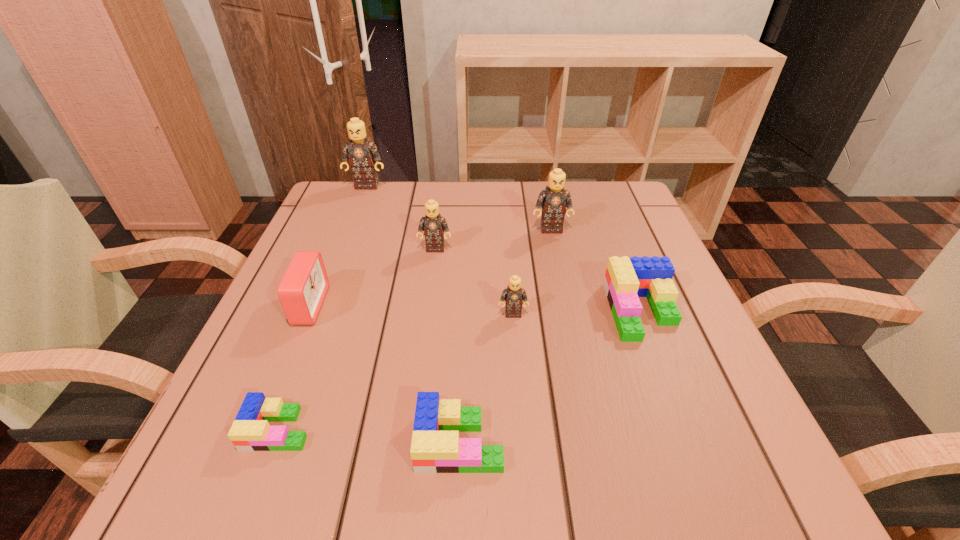
At what (x,y) coordinates should I click in order to perform the action: click on vacant region located on the left of the third shortest object. Please return your answer as a coordinate pair (x, y). Looking at the image, I should click on (488, 311).

What are the coordinates of `vacant area situated 0.110m on the left of the second shortest object` in the screenshot? It's located at (340, 442).

You are a GUI agent. You are given a task and a screenshot of the screen. Output one action in this format:
    pyautogui.click(x=<x>, y=<y>)
    Task: Click on the free space located 0.090m on the back of the smallest green Lego
    The height and width of the screenshot is (540, 960).
    Given the screenshot: What is the action you would take?
    pyautogui.click(x=304, y=361)

Image resolution: width=960 pixels, height=540 pixels. I want to click on alarm clock present at the left edge, so point(302,290).

At what (x,y) coordinates should I click in order to perform the action: click on object positioned at the right edge. Please return your answer as a coordinate pair (x, y). Looking at the image, I should click on (626, 279).

This screenshot has height=540, width=960. I want to click on object that is at the far left corner, so click(x=362, y=154).

This screenshot has width=960, height=540. What are the coordinates of `object present at the near left corner` in the screenshot? It's located at (250, 431).

In the image, there is a desktop. Where is `vacant space at the far edge`? The image size is (960, 540). vacant space at the far edge is located at coordinates (534, 186).

Identify the location of vacant region at the near edge of the desktop. (600, 446).

Where is `vacant space at the left edge`? The height and width of the screenshot is (540, 960). vacant space at the left edge is located at coordinates [x=314, y=330].